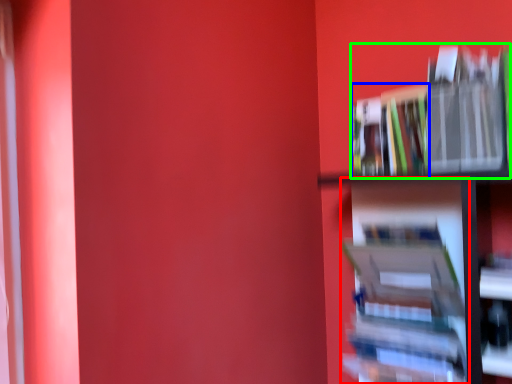
Question: Which is farther away from book (highlighted by a red box)? book (highlighted by a blue box) or book (highlighted by a green box)?

Choices:
 (A) book
 (B) book

Answer: (A)